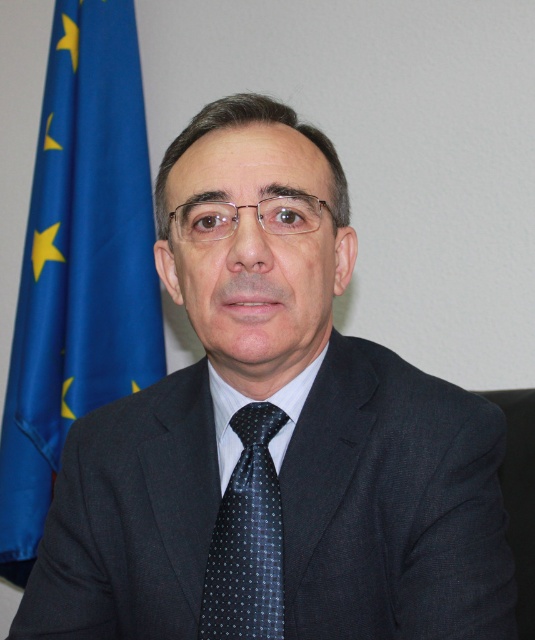
Question: Is blue fabric flag at left wider than dark blue dotted tie at center?

Choices:
 (A) no
 (B) yes

Answer: (B)

Question: Among these objects, which one is nearest to the camera?

Choices:
 (A) blue fabric flag at left
 (B) white smooth dress shirt at center
 (C) dark blue dotted tie at center

Answer: (C)

Question: Is dark blue dotted tie at center behind white smooth dress shirt at center?

Choices:
 (A) no
 (B) yes

Answer: (A)

Question: Does blue fabric flag at left appear over dark blue dotted tie at center?

Choices:
 (A) no
 (B) yes

Answer: (B)

Question: Which of the following is the closest to the observer?

Choices:
 (A) dark blue dotted tie at center
 (B) blue fabric flag at left

Answer: (A)

Question: Which object is closer to the camera taking this photo?

Choices:
 (A) dark blue dotted tie at center
 (B) blue fabric flag at left

Answer: (A)